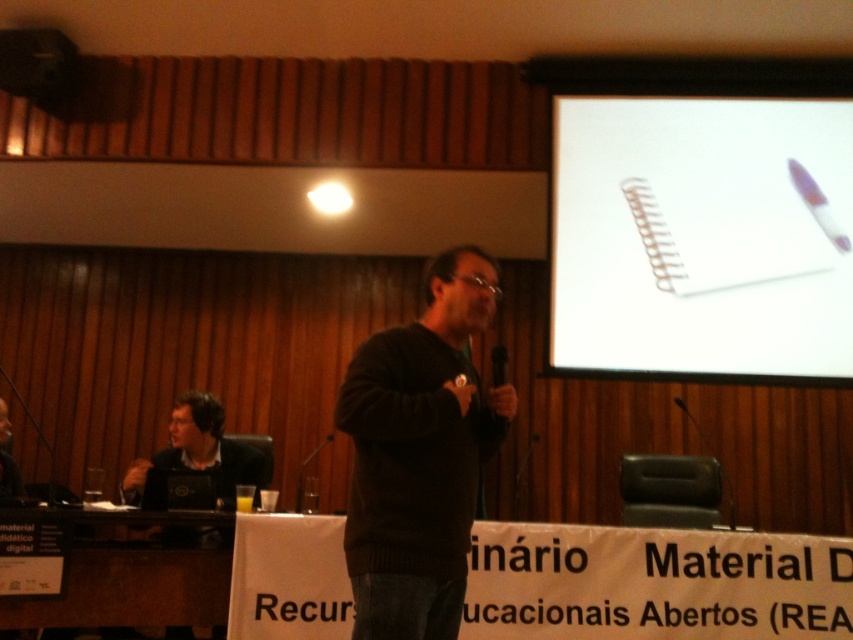
Does dark brown sweater at center have a smaller size compared to matte black laptop at upper left?

No.

Does point (450, 292) come closer to viewer compared to point (55, 70)?

Yes, point (450, 292) is in front of point (55, 70).

Where is `dark brown sweater at center`? dark brown sweater at center is located at coordinates (419, 454).

Does point (415, 602) come in front of point (154, 458)?

That is True.

Identify the location of dark brown sweater at center. (419, 454).

Measure the distance between matte black laptop at lower left and camera.

matte black laptop at lower left is 3.05 meters away from camera.

Does point (258, 477) lie behind point (33, 97)?

No, it is not.

Find the location of a particular element. This screenshot has height=640, width=853. matte black laptop at lower left is located at coordinates (201, 451).